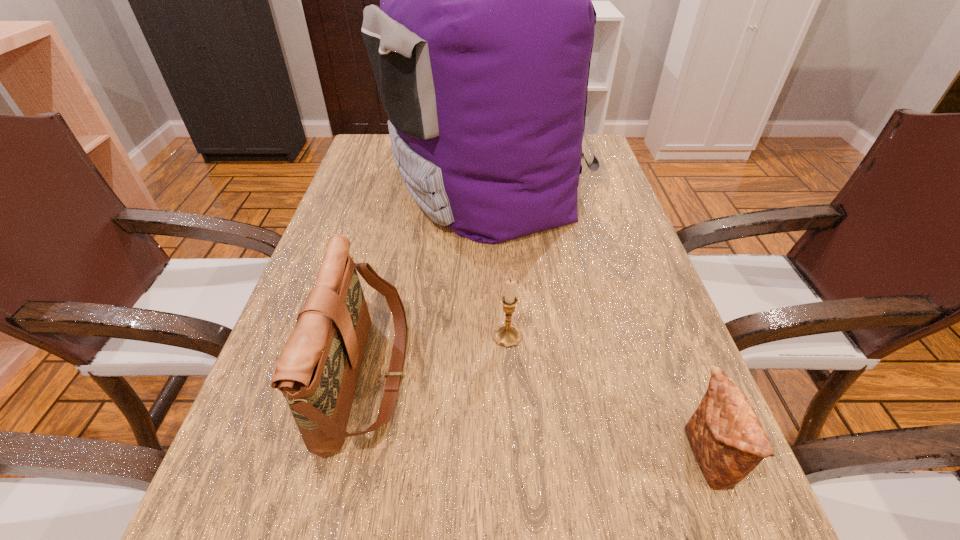
The image size is (960, 540). Find the location of `vacant space located 0.320m on the open side of the clutch bag`. vacant space located 0.320m on the open side of the clutch bag is located at coordinates (x=467, y=459).

Locate an element on the screen. object present at the far edge is located at coordinates (481, 47).

At what (x,y) coordinates should I click in order to perform the action: click on backpack located at the left edge. Please return your answer as a coordinate pair (x, y). The height and width of the screenshot is (540, 960). Looking at the image, I should click on (481, 47).

Locate an element on the screen. The height and width of the screenshot is (540, 960). shoulder bag positioned at the left edge is located at coordinates (317, 372).

Where is `backpack present at the right edge`? The width and height of the screenshot is (960, 540). backpack present at the right edge is located at coordinates (481, 47).

Where is `clutch bag present at the right edge`? The width and height of the screenshot is (960, 540). clutch bag present at the right edge is located at coordinates (728, 441).

The image size is (960, 540). I want to click on object positioned at the far left corner, so coord(481,47).

Where is `object that is at the far right corner`? object that is at the far right corner is located at coordinates (481, 47).

Image resolution: width=960 pixels, height=540 pixels. In the image, there is a desktop. In order to click on free space at the left edge in this screenshot , I will do `click(382, 207)`.

In the image, there is a desktop. Where is `free space at the right edge`? free space at the right edge is located at coordinates (619, 451).